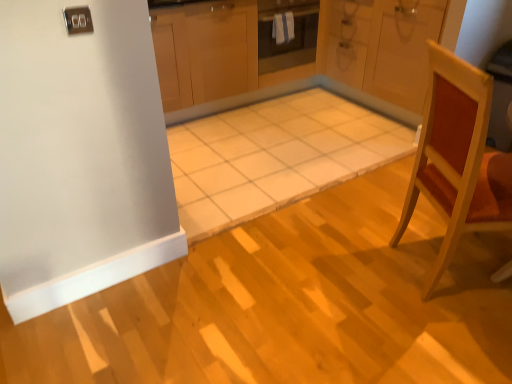
This screenshot has width=512, height=384. What are the coordinates of `free space to the left of wooden chair at right` in the screenshot? It's located at (348, 273).